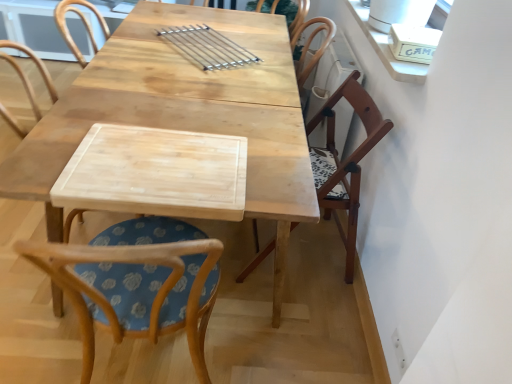
Describe the element at coordinates (137, 282) in the screenshot. I see `wooden chair with floral cushion at center, the first chair positioned from the left` at that location.

The height and width of the screenshot is (384, 512). Describe the element at coordinates (345, 161) in the screenshot. I see `wooden chair at right, which ranks as the 2th chair in left-to-right order` at that location.

Describe the element at coordinates (156, 173) in the screenshot. Image resolution: width=512 pixels, height=384 pixels. I see `natural wood cutting board at center` at that location.

Find the location of a particular element. wooden chair with floral cushion at center, the first chair positioned from the left is located at coordinates (137, 282).

Between natural wood table at center and wooden chair at right, which ranks as the 2th chair in left-to-right order, which one has more height?

Standing taller between the two is wooden chair at right, which ranks as the 2th chair in left-to-right order.

Between natural wood table at center and wooden chair at right, which appears as the 1th chair when viewed from the right, which one has smaller width?

wooden chair at right, which appears as the 1th chair when viewed from the right.

Between point (55, 107) and point (355, 94), which one is positioned in front?

The point (55, 107) is closer.

From the image's perspective, is natural wood table at center located beneath wooden chair at right, which appears as the 1th chair when viewed from the right?

Incorrect, from the image's perspective, natural wood table at center is higher than wooden chair at right, which appears as the 1th chair when viewed from the right.

This screenshot has height=384, width=512. In order to click on plank above the natural wood table at center (from a real-world perspective) in this screenshot , I will do `click(156, 173)`.

Is natural wood table at center directly adjacent to natural wood cutting board at center?

No, natural wood table at center is not touching natural wood cutting board at center.

Between point (93, 59) and point (186, 214), which one is positioned behind?

Point (93, 59)

Is natural wood cutting board at center at the back of natural wood table at center?

No, natural wood table at center is not facing away from natural wood cutting board at center.

From the image's perspective, which object appears higher, natural wood table at center or wooden chair with floral cushion at center, the first chair positioned from the left?

natural wood table at center, from the image's perspective.

Is wooden chair with floral cushion at center, arranged as the second chair when viewed from the right, a part of natural wood table at center?

Absolutely, wooden chair with floral cushion at center, arranged as the second chair when viewed from the right, is inside natural wood table at center.

Locate an element on the screen. The width and height of the screenshot is (512, 384). table that appears above the wooden chair with floral cushion at center, the first chair positioned from the left (from the image's perspective) is located at coordinates (184, 114).

Looking at this image, how many degrees apart are the facing directions of natural wood table at center and wooden chair with floral cushion at center, arranged as the second chair when viewed from the right?

The facing directions of natural wood table at center and wooden chair with floral cushion at center, arranged as the second chair when viewed from the right, are 86.5 degrees apart.

From the image's perspective, which is above, natural wood cutting board at center or natural wood table at center?

natural wood table at center is shown above in the image.

Is natural wood cutting board at center not inside natural wood table at center?

No, natural wood cutting board at center is not entirely external to natural wood table at center.

Does point (186, 186) appear closer or farther from the camera than point (57, 175)?

Point (186, 186).

Considering the sizes of objects natural wood cutting board at center and natural wood table at center in the image provided, who is thinner, natural wood cutting board at center or natural wood table at center?

Thinner between the two is natural wood cutting board at center.

Based on their sizes in the image, would you say natural wood cutting board at center is bigger or smaller than wooden chair with floral cushion at center, the first chair positioned from the left?

In the image, natural wood cutting board at center appears to be smaller than wooden chair with floral cushion at center, the first chair positioned from the left.

There is a natural wood cutting board at center. Identify the location of the 2nd chair below it (from the image's perspective). The height and width of the screenshot is (384, 512). (137, 282).

How far apart are natural wood cutting board at center and wooden chair with floral cushion at center, arranged as the second chair when viewed from the right?

21.78 centimeters.

Which is in front, point (194, 143) or point (93, 328)?

The point (93, 328) is closer.

What's the angular difference between wooden chair at right, which ranks as the 2th chair in left-to-right order, and natural wood table at center's facing directions?

There is a 5.75-degree angle between the facing directions of wooden chair at right, which ranks as the 2th chair in left-to-right order, and natural wood table at center.

In terms of size, does wooden chair at right, which ranks as the 2th chair in left-to-right order, appear bigger or smaller than natural wood table at center?

Considering their sizes, wooden chair at right, which ranks as the 2th chair in left-to-right order, takes up less space than natural wood table at center.

From the picture: From a real-world perspective, who is located lower, wooden chair at right, which appears as the 1th chair when viewed from the right, or natural wood table at center?

In real-world perspective, natural wood table at center is lower.

Is wooden chair at right, which ranks as the 2th chair in left-to-right order, aimed at natural wood table at center?

Yes, wooden chair at right, which ranks as the 2th chair in left-to-right order, is facing natural wood table at center.

What's the angular difference between wooden chair with floral cushion at center, the first chair positioned from the left, and natural wood cutting board at center's facing directions?

The angle between the facing direction of wooden chair with floral cushion at center, the first chair positioned from the left, and the facing direction of natural wood cutting board at center is 1.6 degrees.

Can you confirm if wooden chair with floral cushion at center, the first chair positioned from the left, is smaller than natural wood cutting board at center?

Actually, wooden chair with floral cushion at center, the first chair positioned from the left, might be larger than natural wood cutting board at center.

From the picture: From a real-world perspective, between wooden chair with floral cushion at center, arranged as the second chair when viewed from the right, and natural wood cutting board at center, who is vertically lower?

wooden chair with floral cushion at center, arranged as the second chair when viewed from the right, from a real-world perspective.

This screenshot has width=512, height=384. I want to click on table below the wooden chair at right, which ranks as the 2th chair in left-to-right order (from a real-world perspective), so click(184, 114).

Locate an element on the screen. Image resolution: width=512 pixels, height=384 pixels. plank on the right of natural wood table at center is located at coordinates (156, 173).

Which object lies nearer to the anchor point wooden chair with floral cushion at center, arranged as the second chair when viewed from the right, natural wood table at center or natural wood cutting board at center?

The object closer to wooden chair with floral cushion at center, arranged as the second chair when viewed from the right, is natural wood cutting board at center.

Based on their spatial positions, is natural wood cutting board at center or wooden chair at right, which appears as the 1th chair when viewed from the right, further from natural wood table at center?

wooden chair at right, which appears as the 1th chair when viewed from the right, is positioned further to the anchor natural wood table at center.

Looking at the image, which one is located further to wooden chair with floral cushion at center, the first chair positioned from the left, wooden chair at right, which appears as the 1th chair when viewed from the right, or natural wood table at center?

The object further to wooden chair with floral cushion at center, the first chair positioned from the left, is wooden chair at right, which appears as the 1th chair when viewed from the right.

Which object lies nearer to the anchor point wooden chair with floral cushion at center, arranged as the second chair when viewed from the right, natural wood cutting board at center or wooden chair at right, which ranks as the 2th chair in left-to-right order?

natural wood cutting board at center.

Considering their positions, is wooden chair with floral cushion at center, arranged as the second chair when viewed from the right, positioned closer to natural wood cutting board at center than wooden chair at right, which ranks as the 2th chair in left-to-right order?

wooden chair with floral cushion at center, arranged as the second chair when viewed from the right.

Which object lies nearer to the anchor point wooden chair with floral cushion at center, the first chair positioned from the left, natural wood table at center or wooden chair at right, which ranks as the 2th chair in left-to-right order?

Based on the image, natural wood table at center appears to be nearer to wooden chair with floral cushion at center, the first chair positioned from the left.

Considering their positions, is wooden chair with floral cushion at center, the first chair positioned from the left, positioned closer to wooden chair at right, which ranks as the 2th chair in left-to-right order, than natural wood table at center?

The object closer to wooden chair at right, which ranks as the 2th chair in left-to-right order, is natural wood table at center.

From the image, which object appears to be farther from wooden chair with floral cushion at center, arranged as the second chair when viewed from the right, natural wood cutting board at center or natural wood table at center?

natural wood table at center.

Find the location of `table between wooden chair with floral cushion at center, the first chair positioned from the left, and wooden chair at right, which appears as the 1th chair when viewed from the right, in the front-back direction`. table between wooden chair with floral cushion at center, the first chair positioned from the left, and wooden chair at right, which appears as the 1th chair when viewed from the right, in the front-back direction is located at coordinates (184, 114).

This screenshot has height=384, width=512. Find the location of `plank between natural wood table at center and wooden chair with floral cushion at center, arranged as the second chair when viewed from the right, in the vertical direction`. plank between natural wood table at center and wooden chair with floral cushion at center, arranged as the second chair when viewed from the right, in the vertical direction is located at coordinates (156, 173).

Identify the location of plank between wooden chair with floral cushion at center, arranged as the second chair when viewed from the right, and wooden chair at right, which ranks as the 2th chair in left-to-right order, in the front-back direction. This screenshot has height=384, width=512. (156, 173).

This screenshot has width=512, height=384. I want to click on plank situated between natural wood table at center and wooden chair at right, which ranks as the 2th chair in left-to-right order, from left to right, so click(156, 173).